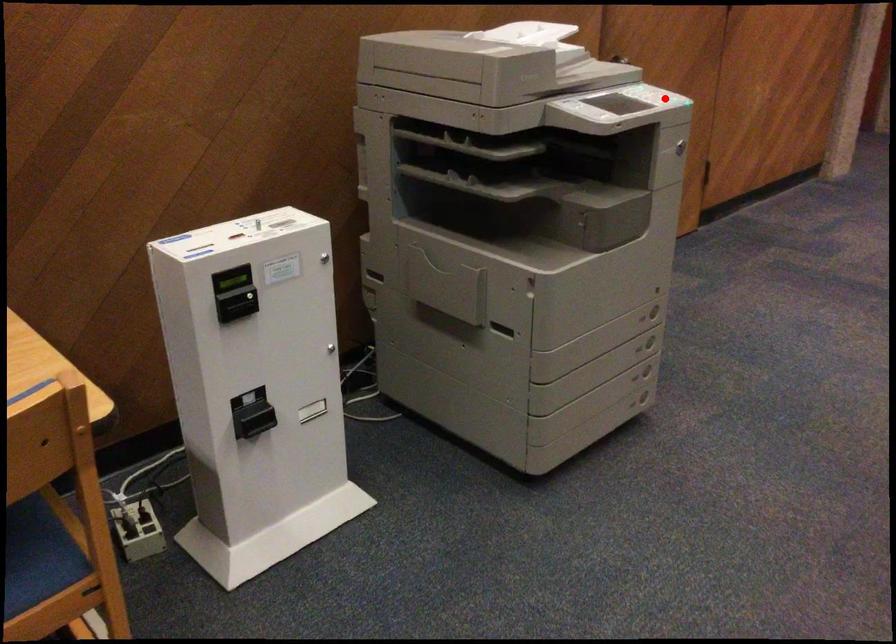
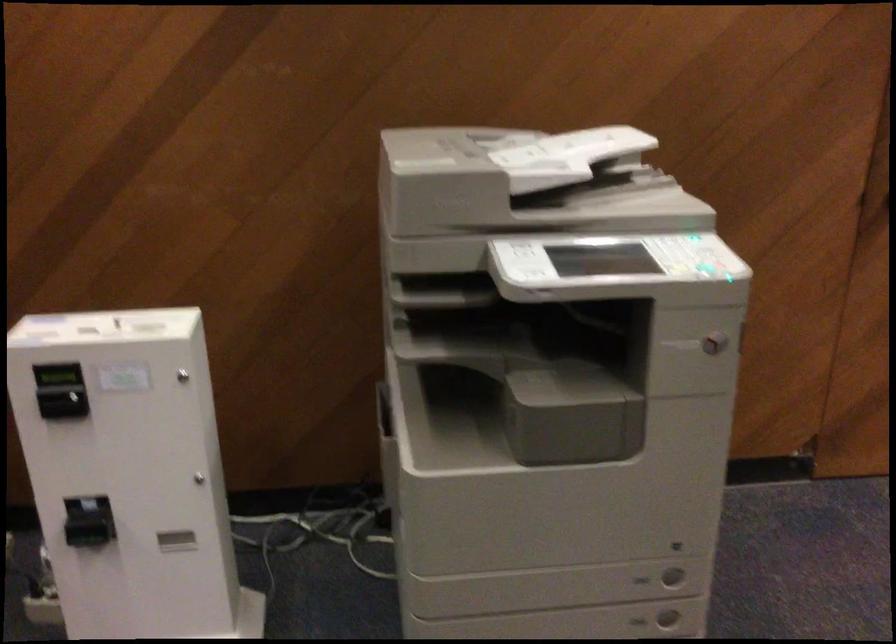
Locate, in the second image, the point that corresponds to the highlighted location in the first image.

(698, 266)